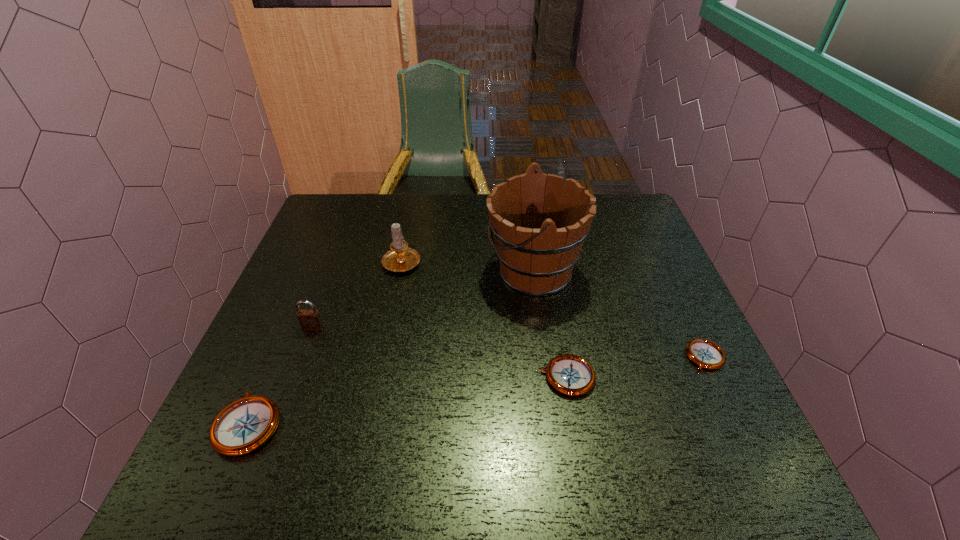
Where is `vacant region between the third object from left to right and the leftmost compass`? The width and height of the screenshot is (960, 540). vacant region between the third object from left to right and the leftmost compass is located at coordinates (325, 342).

At what (x,y) coordinates should I click in order to perform the action: click on vacant region between the second compass from right to left and the leftmost compass. Please return your answer as a coordinate pair (x, y). The width and height of the screenshot is (960, 540). Looking at the image, I should click on (408, 400).

Where is `empty location between the fifth tallest object and the candle`? Image resolution: width=960 pixels, height=540 pixels. empty location between the fifth tallest object and the candle is located at coordinates (484, 319).

At what (x,y) coordinates should I click in order to perform the action: click on vacant space in between the second shortest compass and the rightmost object. Please return your answer as a coordinate pair (x, y). Looking at the image, I should click on (636, 367).

Find the location of a particular element. The width and height of the screenshot is (960, 540). free space between the third farthest object and the second tallest object is located at coordinates (358, 295).

This screenshot has width=960, height=540. In order to click on free space between the third farthest object and the tallest object in this screenshot , I will do `click(423, 300)`.

In order to click on vacant region between the third tallest object and the tallest object in this screenshot , I will do point(423,300).

The height and width of the screenshot is (540, 960). In order to click on free spot between the shortest compass and the second tallest compass in this screenshot , I will do `click(636, 367)`.

Where is `unoccupied position between the fifth tallest object and the rightmost object`? The image size is (960, 540). unoccupied position between the fifth tallest object and the rightmost object is located at coordinates (636, 367).

The height and width of the screenshot is (540, 960). Identify the location of the third closest object to the fourth nearest object. (539, 227).